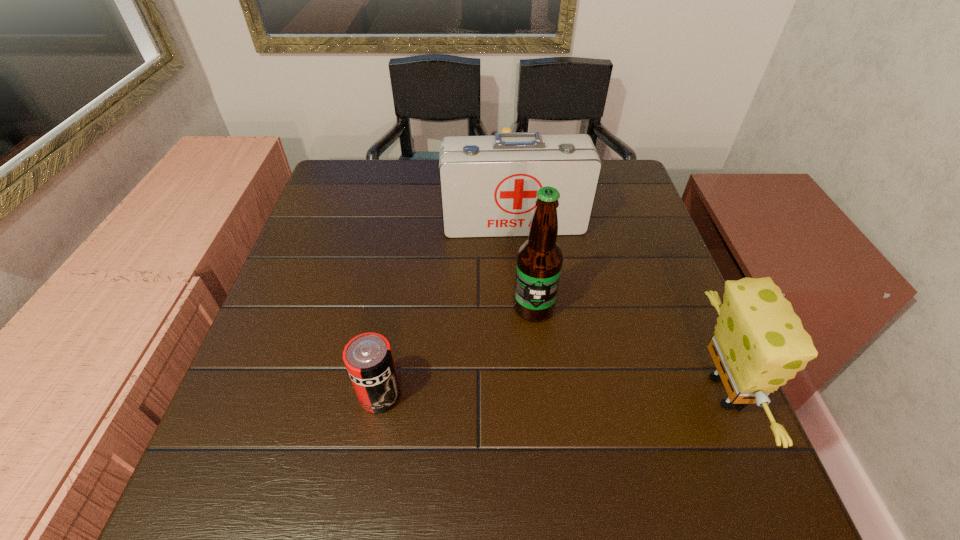
Identify the location of empty location between the can and the second farthest object. (447, 308).

Where is `vacant area between the can and the rightmost object`? vacant area between the can and the rightmost object is located at coordinates (551, 394).

Find the location of a particular element. The width and height of the screenshot is (960, 540). vacant area between the leftmost object and the rightmost object is located at coordinates (551, 394).

The image size is (960, 540). Find the location of `vacant region between the sponge and the second shortest object`. vacant region between the sponge and the second shortest object is located at coordinates (551, 394).

This screenshot has width=960, height=540. I want to click on vacant space that's between the farthest object and the beer bottle, so click(x=519, y=237).

In order to click on vacant region between the shortest object and the rightmost object in this screenshot , I will do `click(613, 279)`.

What are the coordinates of `empty space between the sponge and the tallest object` in the screenshot? It's located at [628, 350].

Where is `object that is the closest one to the sponge`? object that is the closest one to the sponge is located at coordinates (539, 260).

Identify the location of object that is the third closest to the fourth nearest object. This screenshot has width=960, height=540. (759, 343).

The height and width of the screenshot is (540, 960). Find the location of `free space that satisfies the following two spatial constraints: 1. on the back side of the shortest object; 2. on the right side of the leftmost object`. free space that satisfies the following two spatial constraints: 1. on the back side of the shortest object; 2. on the right side of the leftmost object is located at coordinates (420, 166).